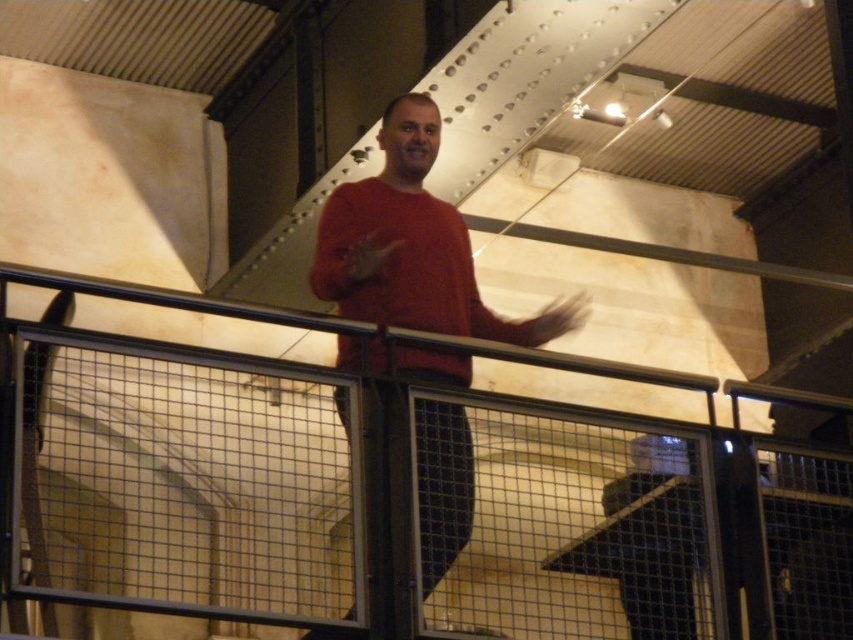
Question: Which of the following is the closest to the observer?

Choices:
 (A) black metal railing at upper center
 (B) matte red sweater at center

Answer: (B)

Question: Can you confirm if matte red sweater at center is thinner than black metal railing at upper center?

Choices:
 (A) yes
 (B) no

Answer: (A)

Question: Is matte red sweater at center positioned before black metal railing at upper center?

Choices:
 (A) no
 (B) yes

Answer: (B)

Question: Is matte red sweater at center in front of black metal railing at upper center?

Choices:
 (A) no
 (B) yes

Answer: (B)

Question: Which point is farther from the camera taking this photo?

Choices:
 (A) (341, 260)
 (B) (466, 349)

Answer: (A)